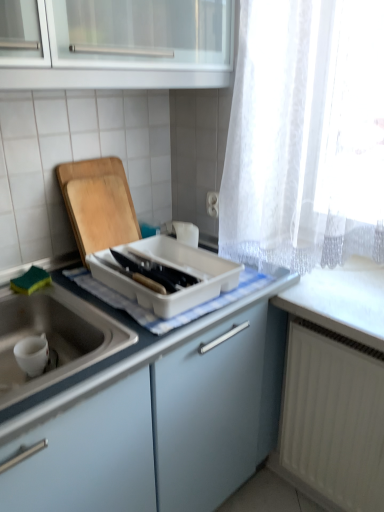
Question: Is white matte sink at lower left positioned far away from wooden cutting board at left?

Choices:
 (A) no
 (B) yes

Answer: (A)

Question: From the image's perspective, is white matte sink at lower left located beneath wooden cutting board at left?

Choices:
 (A) yes
 (B) no

Answer: (A)

Question: Is white matte sink at lower left looking in the opposite direction of wooden cutting board at left?

Choices:
 (A) no
 (B) yes

Answer: (A)

Question: Does white matte sink at lower left lie behind wooden cutting board at left?

Choices:
 (A) no
 (B) yes

Answer: (A)

Question: Does white matte sink at lower left have a smaller size compared to wooden cutting board at left?

Choices:
 (A) no
 (B) yes

Answer: (A)

Question: From a real-world perspective, is white matte sink at lower left below wooden cutting board at left?

Choices:
 (A) no
 (B) yes

Answer: (B)

Question: Is white matte sink at lower left wider than white matte radiator at lower right?

Choices:
 (A) no
 (B) yes

Answer: (B)

Question: From the image's perspective, would you say white matte sink at lower left is positioned over white matte radiator at lower right?

Choices:
 (A) no
 (B) yes

Answer: (B)

Question: Is white matte sink at lower left with white matte radiator at lower right?

Choices:
 (A) no
 (B) yes

Answer: (A)

Question: Is white matte sink at lower left at the left side of white matte radiator at lower right?

Choices:
 (A) no
 (B) yes

Answer: (B)

Question: Considering the relative sizes of white matte sink at lower left and white matte radiator at lower right in the image provided, is white matte sink at lower left shorter than white matte radiator at lower right?

Choices:
 (A) no
 (B) yes

Answer: (B)

Question: Considering the relative sizes of white matte sink at lower left and white matte radiator at lower right in the image provided, is white matte sink at lower left thinner than white matte radiator at lower right?

Choices:
 (A) no
 (B) yes

Answer: (A)

Question: Does wooden cutting board at left appear on the left side of white matte sink at lower left?

Choices:
 (A) yes
 (B) no

Answer: (B)